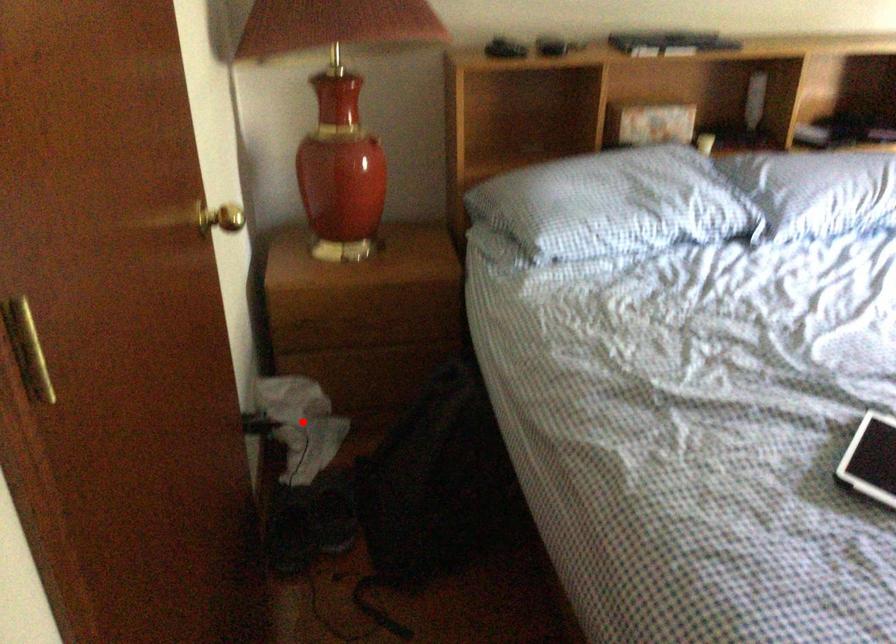
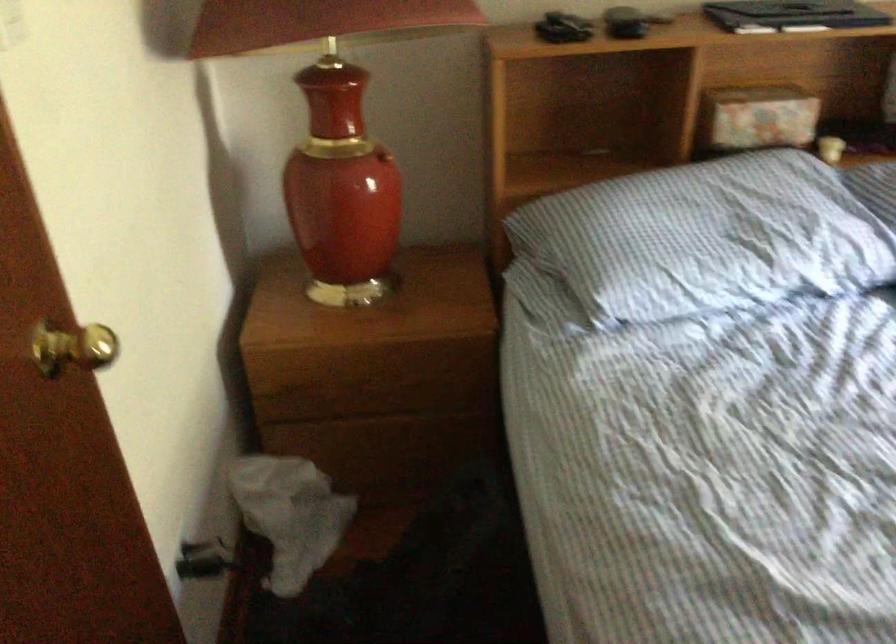
Question: A red point is marked in image1. In image2, is the corresponding 3D point closer to the camera or farther? Reply with the corresponding letter.

Choices:
 (A) The corresponding 3D point is closer.
 (B) The corresponding 3D point is farther.

Answer: (A)